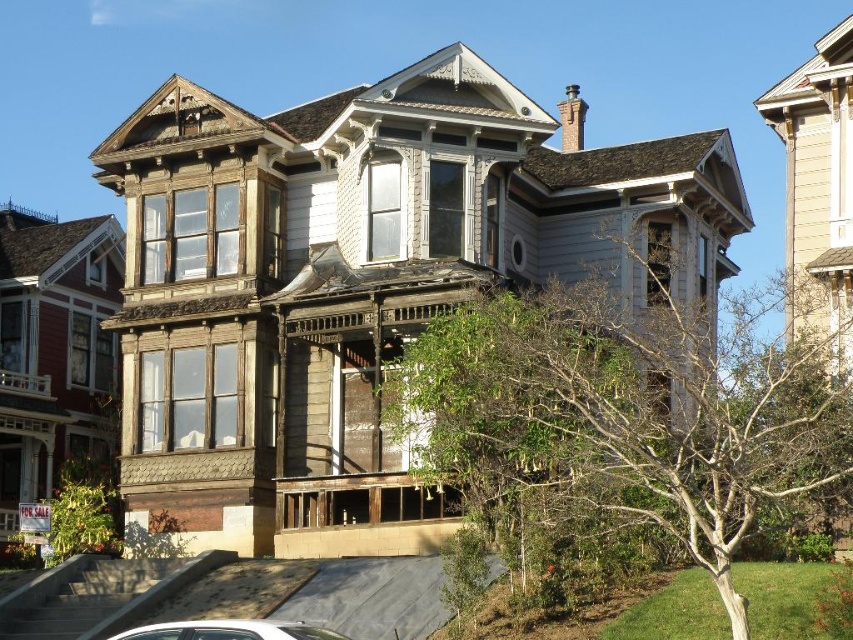
Between point (508, 461) and point (206, 634), which one is positioned behind?

The point (508, 461) is more distant.

This screenshot has width=853, height=640. I want to click on green leafy tree at center, so click(x=624, y=412).